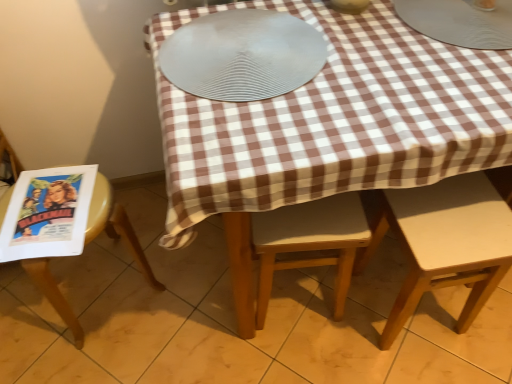
You are a GUI agent. You are given a task and a screenshot of the screen. Output one action in this format:
    pyautogui.click(x=<x>, y=<y>)
    Task: Click on the vacant space underneath light brown wooden chair at center, arranged as the second chair when viewed from the right (from a real-world perspective)
    Image resolution: width=512 pixels, height=384 pixels.
    Given the screenshot: What is the action you would take?
    pyautogui.click(x=295, y=302)